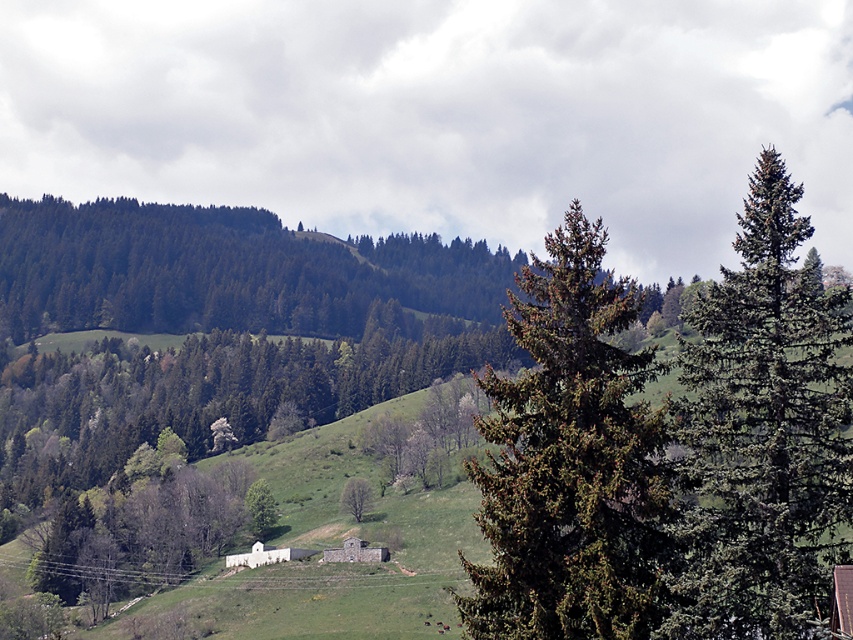
Looking at this image, does green needle-like tree at right appear over green matte tree at lower left?

Yes.

Is green needle-like tree at right positioned before green matte tree at lower left?

Yes, green needle-like tree at right is closer to the viewer.

The height and width of the screenshot is (640, 853). What are the coordinates of `green needle-like tree at right` in the screenshot? It's located at (763, 433).

Does green needle-like tree at center have a lesser height compared to green matte tree at lower left?

No.

Between green needle-like tree at center and green matte tree at lower left, which one has more height?

With more height is green needle-like tree at center.

Between point (592, 419) and point (132, 509), which one is positioned behind?

Point (132, 509)

You are a GUI agent. You are given a task and a screenshot of the screen. Output one action in this format:
    pyautogui.click(x=<x>, y=<y>)
    Task: Click on the green needle-like tree at center
    The height and width of the screenshot is (640, 853).
    Given the screenshot: What is the action you would take?
    pyautogui.click(x=572, y=461)

Does green needle-like tree at right have a greater height compared to green needle-like tree at center?

In fact, green needle-like tree at right may be shorter than green needle-like tree at center.

Between green needle-like tree at right and green needle-like tree at center, which one has less height?

With less height is green needle-like tree at right.

At what (x,y) coordinates should I click in order to perform the action: click on green needle-like tree at right. Please return your answer as a coordinate pair (x, y). This screenshot has height=640, width=853. Looking at the image, I should click on (763, 433).

You are a GUI agent. You are given a task and a screenshot of the screen. Output one action in this format:
    pyautogui.click(x=<x>, y=<y>)
    Task: Click on the green needle-like tree at right
    This screenshot has height=640, width=853.
    Given the screenshot: What is the action you would take?
    pyautogui.click(x=763, y=433)